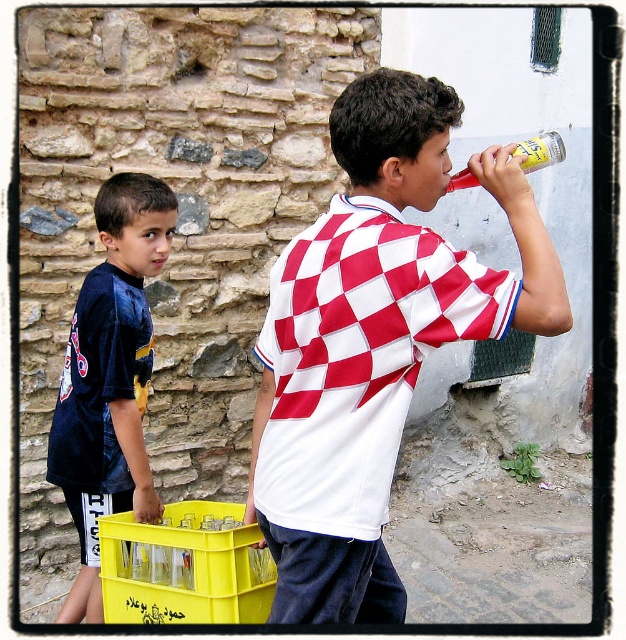
Question: Which object is closer to the camera taking this photo?

Choices:
 (A) translucent plastic bottle at upper right
 (B) dark blue jersey at left
 (C) white checkered shirt at center

Answer: (C)

Question: Can you confirm if dark blue jersey at left is positioned to the right of translucent plastic bottle at upper right?

Choices:
 (A) yes
 (B) no

Answer: (B)

Question: Is white checkered shirt at center further to the viewer compared to dark blue jersey at left?

Choices:
 (A) yes
 (B) no

Answer: (B)

Question: Which object is the closest to the dark blue jersey at left?

Choices:
 (A) translucent plastic bottle at upper right
 (B) white checkered shirt at center

Answer: (B)

Question: Is white checkered shirt at center wider than translucent plastic bottle at upper right?

Choices:
 (A) yes
 (B) no

Answer: (A)

Question: Among these points, which one is farthest from the camera?

Choices:
 (A) (110, 188)
 (B) (563, 157)

Answer: (A)